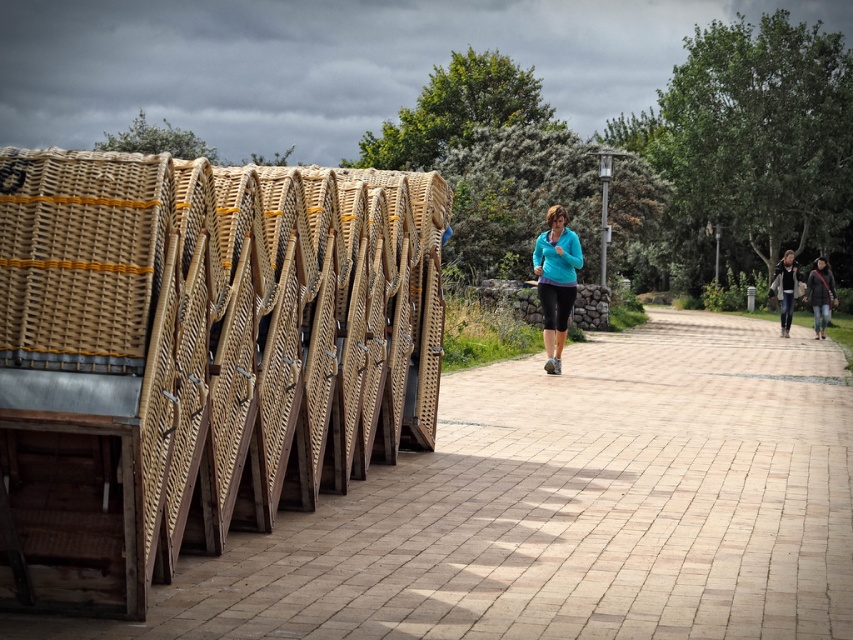
You are standing at the entrance of the pathway lined with wicker beach chairs and want to reach the dark gray knit sweater at center right. The pathway is 50 feet long. Can you walk straight ahead without detouring to reach the sweater?

The dark gray knit sweater at center right is 71.71 feet away from your current position. Since the pathway is only 50 feet long, you cannot reach it by walking straight ahead as the distance exceeds the pathway length. You need to find another route or detour.

You are trying to decide which item to take with you for a hike. You see the dark gray knit sweater at center right and the dark gray textured jacket at right. Which one is shorter in length?

The dark gray knit sweater at center right is shorter than the dark gray textured jacket at right.

You are organizing a small outdoor event and need to place two items on a narrow shelf. The teal fleece jacket at center and the dark gray knit sweater at center right must be placed side by side. Given their sizes, will they both fit on a shelf that is 1.2 meters wide?

The teal fleece jacket at center is narrower than the dark gray knit sweater at center right. However, without knowing the exact widths of both items, it is impossible to determine if their combined width will exceed the 1.2 meter shelf. Additional measurements are needed.